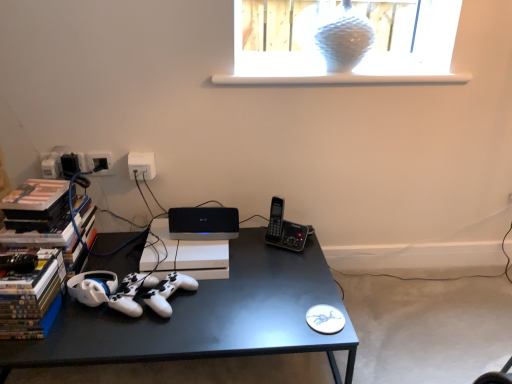
The height and width of the screenshot is (384, 512). I want to click on free space to the right of hardcover books at left, so click(74, 334).